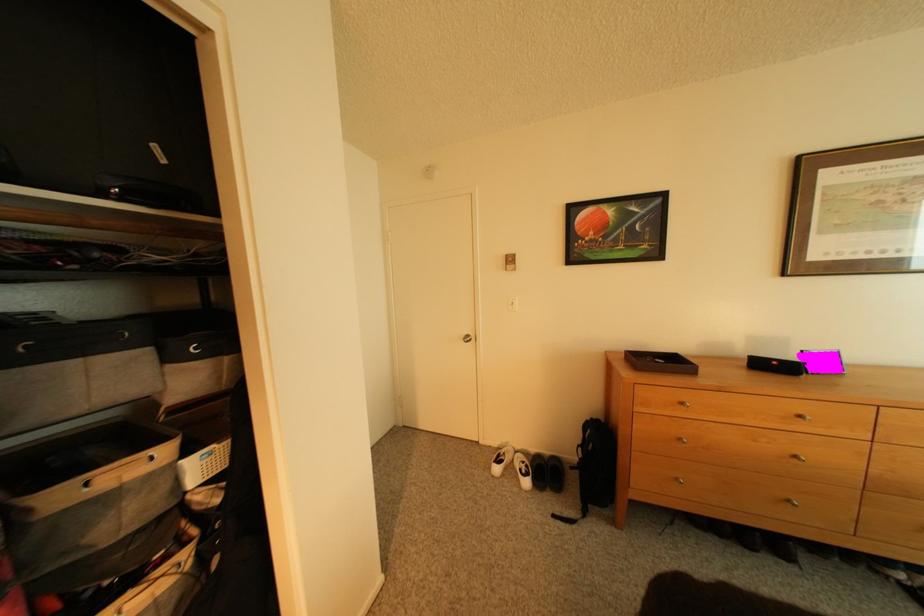
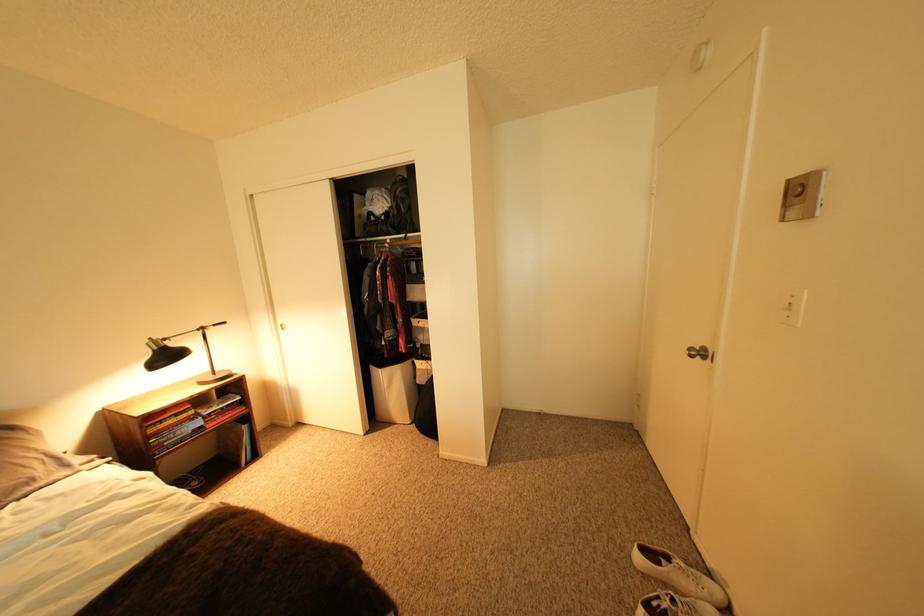
The point at (524,305) is marked in the first image. Where is the corresponding point in the second image?

(799, 307)